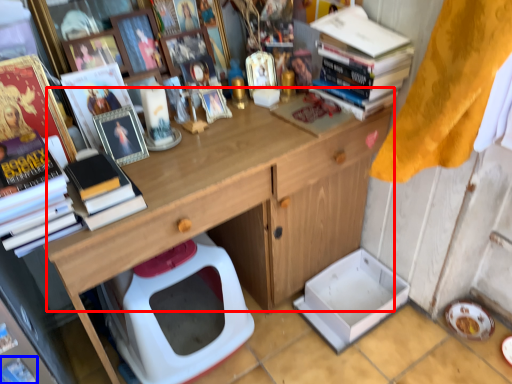
Question: Which object is closer to the camera taking this photo, counter top (highlighted by a red box) or magazine (highlighted by a blue box)?

Choices:
 (A) counter top
 (B) magazine

Answer: (A)